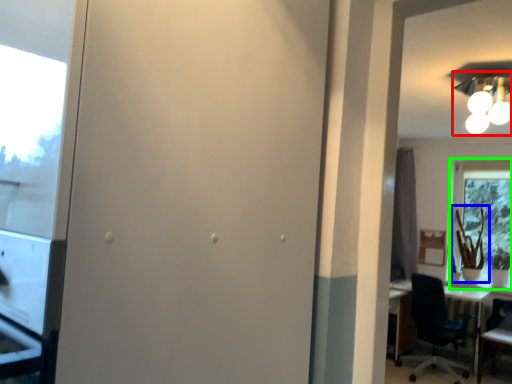
Question: Which object is positioned closest to light fixture (highlighted by a red box)? Select from plant (highlighted by a blue box) and window (highlighted by a green box).

Choices:
 (A) plant
 (B) window

Answer: (B)